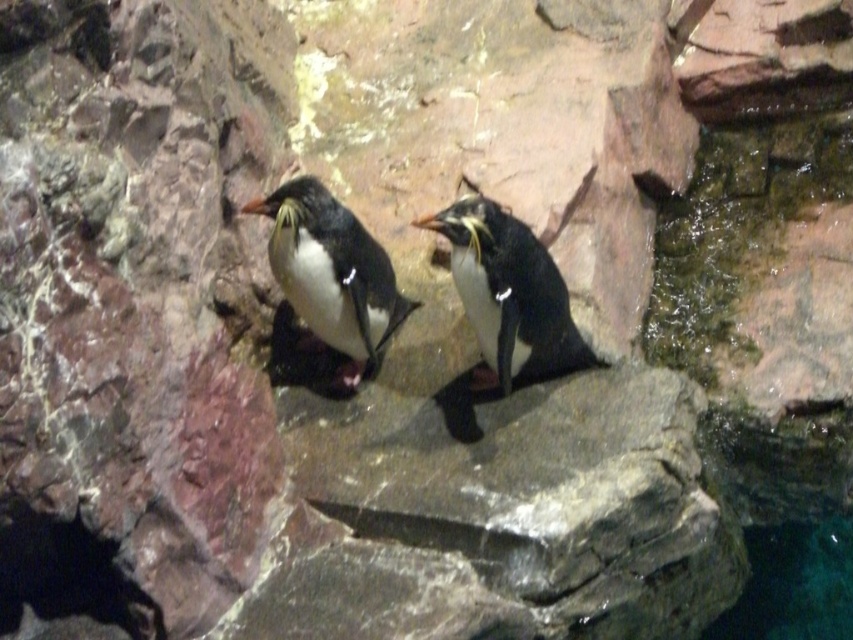
You are a zookeeper observing the penguin enclosure. You notice the black matte penguin at center and the clear blue water at lower right. Which object takes up more space in the image?

The black matte penguin at center takes up more space in the image because it is bigger than the clear blue water at lower right according to the description.

You are a zookeeper observing two penguins in their enclosure. You notice a black matte penguin at center and a white matte penguin at center. Which penguin is shorter?

The black matte penguin at center is shorter than the white matte penguin at center.